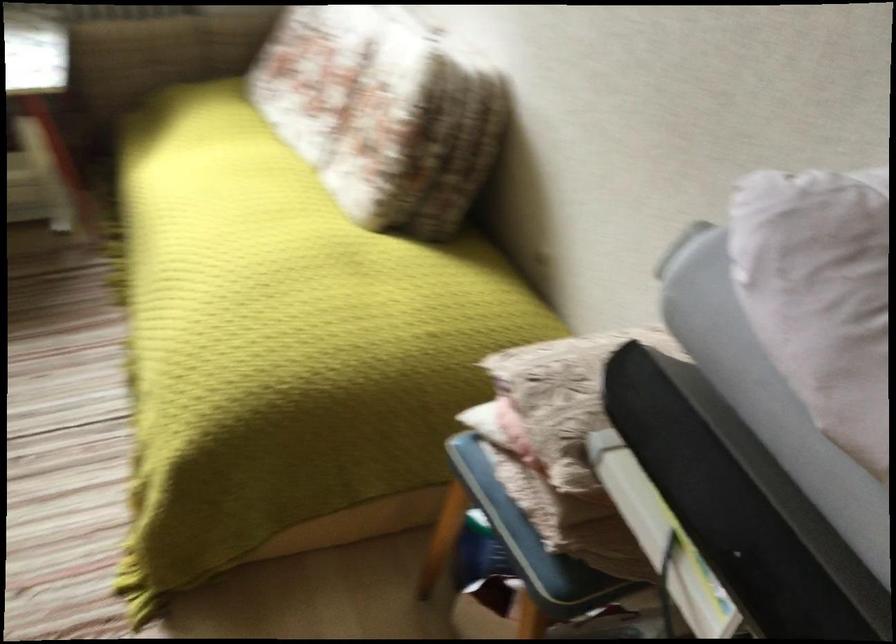
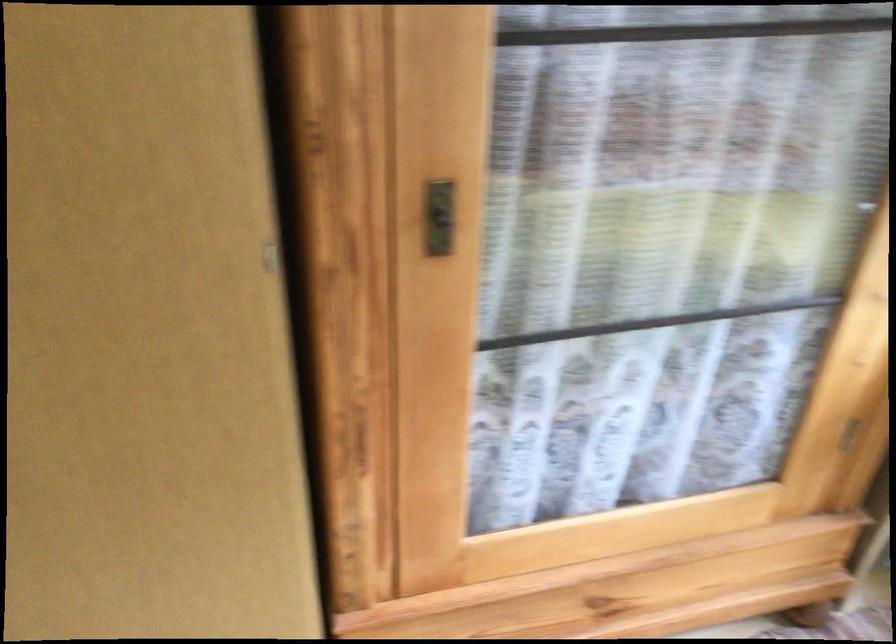
Consider the image. The first image is from the beginning of the video and the second image is from the end. How did the camera likely rotate when shooting the video?

The camera's rotation is toward left-down.